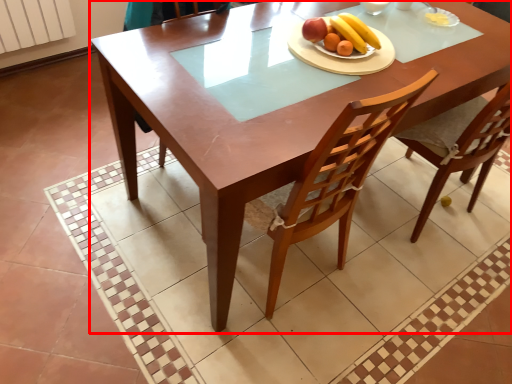
Question: From the image's perspective, considering the relative positions of table (annotated by the red box) and fruit salad in the image provided, where is table (annotated by the red box) located with respect to the staircase?

Choices:
 (A) below
 (B) above

Answer: (A)